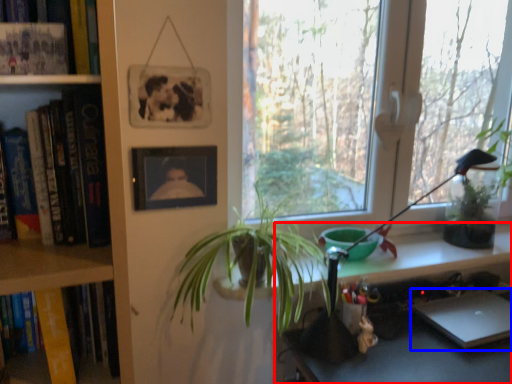
Question: Which point is further to the camera, desk (highlighted by a red box) or laptop (highlighted by a blue box)?

Choices:
 (A) desk
 (B) laptop

Answer: (B)